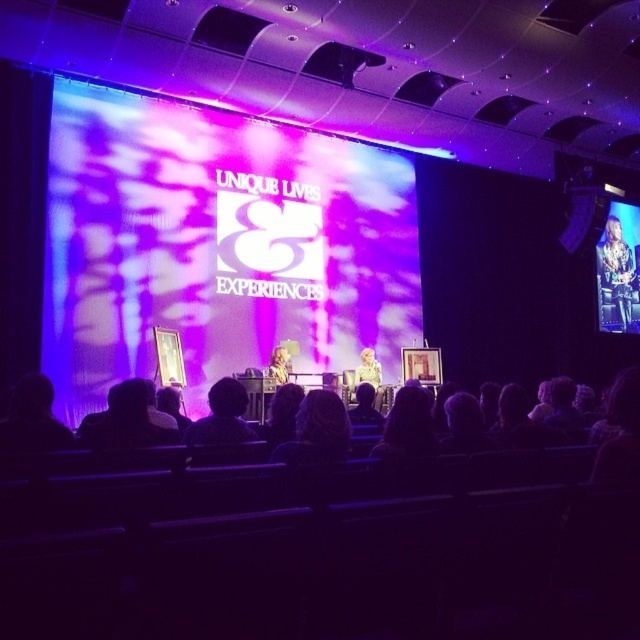
Does matte purple fabric at center appear on the left side of dark hair at center?

Correct, you'll find matte purple fabric at center to the left of dark hair at center.

Can you confirm if matte purple fabric at center is positioned above dark hair at center?

No.

Where is `matte purple fabric at center`? matte purple fabric at center is located at coordinates (216, 244).

This screenshot has width=640, height=640. What are the coordinates of `matte purple fabric at center` in the screenshot? It's located at (216, 244).

Identify the location of matte purple fabric at center. The height and width of the screenshot is (640, 640). (216, 244).

Can you confirm if matte purple fabric at center is positioned above blonde hair at center?

Indeed, matte purple fabric at center is positioned over blonde hair at center.

Which is behind, point (362, 328) or point (278, 381)?

Positioned behind is point (362, 328).

At what (x,y) coordinates should I click in order to perform the action: click on matte purple fabric at center. Please return your answer as a coordinate pair (x, y). This screenshot has height=640, width=640. Looking at the image, I should click on (216, 244).

Can you confirm if matte purple fabric at center is positioned to the right of light brown leather jacket at right?

No, matte purple fabric at center is not to the right of light brown leather jacket at right.

Does point (56, 333) come closer to viewer compared to point (637, 262)?

Yes.

Who is more forward, (218, 358) or (632, 298)?

Positioned in front is point (218, 358).

You are a GUI agent. You are given a task and a screenshot of the screen. Output one action in this format:
    pyautogui.click(x=<x>, y=<y>)
    Task: Click on the matte purple fabric at center
    The height and width of the screenshot is (640, 640).
    Given the screenshot: What is the action you would take?
    pyautogui.click(x=216, y=244)